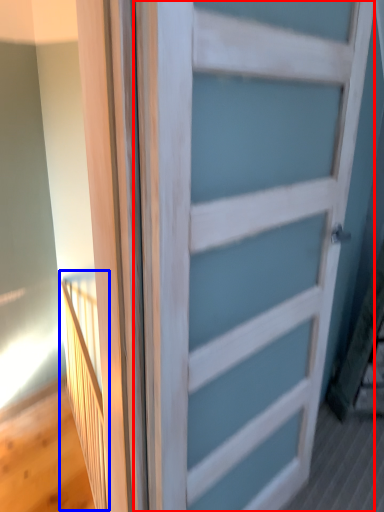
Question: Which object appears closest to the camera in this image, door (highlighted by a red box) or elevator (highlighted by a blue box)?

Choices:
 (A) door
 (B) elevator

Answer: (A)